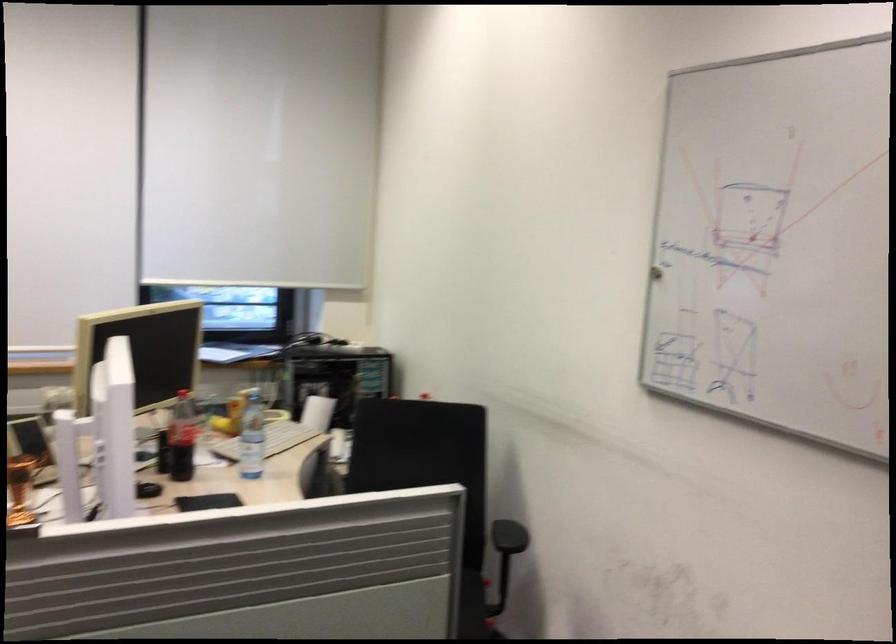
Find the location of `black computer mouse`. black computer mouse is located at coordinates (147, 489).